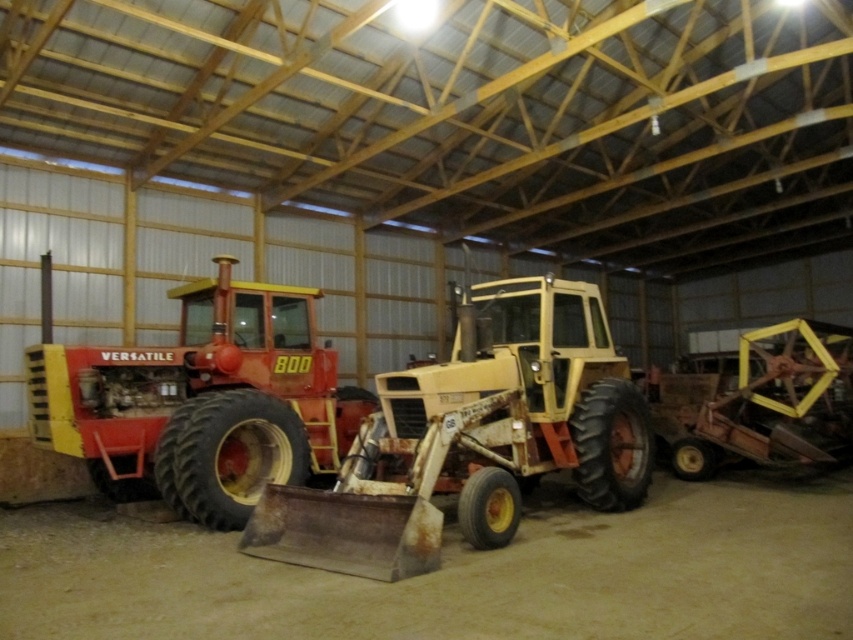
You are a worker in the warehouse and need to move a heavy box from the rusty metal tractor at center to the matte red tractor at left. Which direction should you move the box to reach the destination?

The rusty metal tractor at center is to the right of the matte red tractor at left, so you should move the box to the left to reach the matte red tractor at left.

You need to park a new vehicle that is 2 meters wide in this warehouse. The rusty metal tractor at center and the matte red tractor at left are already parked. Which tractor should you move to make space for the new vehicle?

The rusty metal tractor at center has a smaller width than the matte red tractor at left, so moving the matte red tractor at left would free up more space for the new vehicle since it is wider and occupies more area.

You are a worker in the warehouse and need to determine which tractor is closer to the ground. Based on the scene, which one is lower in height between the rusty metal tractor at center and the matte red tractor at left?

The rusty metal tractor at center is shorter than the matte red tractor at left, so the rusty metal tractor at center is lower in height.